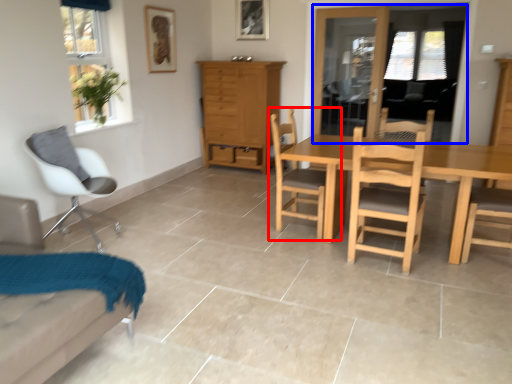
Question: Which object appears farthest to the camera in this image, chair (highlighted by a red box) or window screen (highlighted by a blue box)?

Choices:
 (A) chair
 (B) window screen

Answer: (B)